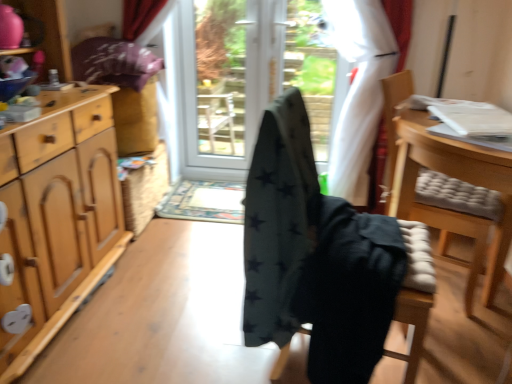
Question: From the image's perspective, does dark green fabric chair at center, positioned as the 2th chair in right-to-left order, appear lower than light wood cabinet at left?

Choices:
 (A) yes
 (B) no

Answer: (A)

Question: Considering the relative sizes of dark green fabric chair at center, positioned as the 2th chair in right-to-left order, and light wood cabinet at left in the image provided, is dark green fabric chair at center, positioned as the 2th chair in right-to-left order, smaller than light wood cabinet at left?

Choices:
 (A) no
 (B) yes

Answer: (B)

Question: Is dark green fabric chair at center, positioned as the 2th chair in right-to-left order, not close to light wood cabinet at left?

Choices:
 (A) no
 (B) yes

Answer: (B)

Question: Considering the relative sizes of dark green fabric chair at center, positioned as the 2th chair in right-to-left order, and light wood cabinet at left in the image provided, is dark green fabric chair at center, positioned as the 2th chair in right-to-left order, wider than light wood cabinet at left?

Choices:
 (A) no
 (B) yes

Answer: (A)

Question: Does dark green fabric chair at center, positioned as the 2th chair in right-to-left order, have a greater height compared to light wood cabinet at left?

Choices:
 (A) yes
 (B) no

Answer: (B)

Question: From the image's perspective, is dark gray fabric chair at center, which is the first chair from left to right, positioned above or below light wood cabinet at left?

Choices:
 (A) below
 (B) above

Answer: (A)

Question: Considering the relative positions of dark gray fabric chair at center, which is the first chair from left to right, and light wood cabinet at left in the image provided, is dark gray fabric chair at center, which is the first chair from left to right, to the left or to the right of light wood cabinet at left?

Choices:
 (A) right
 (B) left

Answer: (A)

Question: Looking at the image, does dark gray fabric chair at center, which is counted as the third chair, starting from the right, seem bigger or smaller compared to light wood cabinet at left?

Choices:
 (A) big
 (B) small

Answer: (B)

Question: Is dark gray fabric chair at center, which is counted as the third chair, starting from the right, taller or shorter than light wood cabinet at left?

Choices:
 (A) tall
 (B) short

Answer: (B)

Question: Is wooden cushioned chair at right, the 1th chair positioned from the right, wider or thinner than black fabric screen door at center, which is the first screen door from right to left?

Choices:
 (A) wide
 (B) thin

Answer: (A)

Question: Is wooden cushioned chair at right, the 1th chair positioned from the right, taller or shorter than black fabric screen door at center, arranged as the 2th screen door when viewed from the left?

Choices:
 (A) tall
 (B) short

Answer: (B)

Question: Considering the relative positions of wooden cushioned chair at right, placed as the third chair when sorted from left to right, and black fabric screen door at center, which is the first screen door from right to left, in the image provided, is wooden cushioned chair at right, placed as the third chair when sorted from left to right, to the left or to the right of black fabric screen door at center, which is the first screen door from right to left,?

Choices:
 (A) right
 (B) left

Answer: (A)

Question: Relative to black fabric screen door at center, which is the first screen door from right to left, is wooden cushioned chair at right, the 1th chair positioned from the right, in front or behind?

Choices:
 (A) behind
 (B) front

Answer: (B)

Question: Considering the relative positions of wooden cushioned chair at right, placed as the third chair when sorted from left to right, and dark gray fabric chair at center, which is the first chair from left to right, in the image provided, is wooden cushioned chair at right, placed as the third chair when sorted from left to right, to the left or to the right of dark gray fabric chair at center, which is the first chair from left to right,?

Choices:
 (A) left
 (B) right

Answer: (B)

Question: From the image's perspective, is wooden cushioned chair at right, the 1th chair positioned from the right, positioned above or below dark gray fabric chair at center, which is the first chair from left to right?

Choices:
 (A) below
 (B) above

Answer: (B)